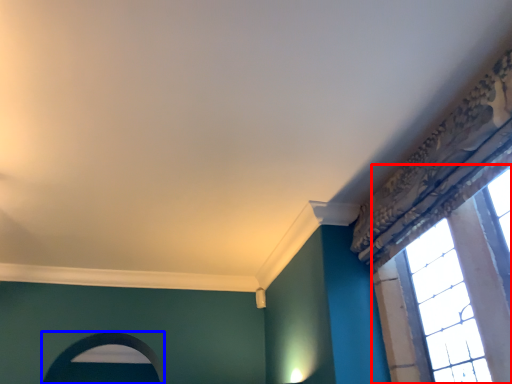
Question: Which object is closer to the camera taking this photo, window (highlighted by a red box) or archway (highlighted by a blue box)?

Choices:
 (A) window
 (B) archway

Answer: (A)